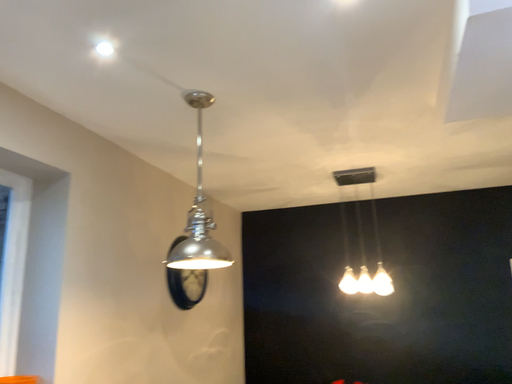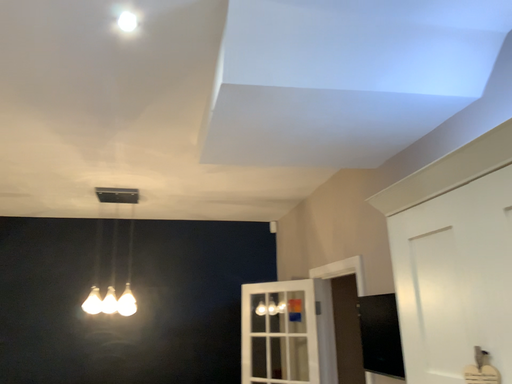
Question: How did the camera likely rotate when shooting the video?

Choices:
 (A) rotated right
 (B) rotated left

Answer: (A)